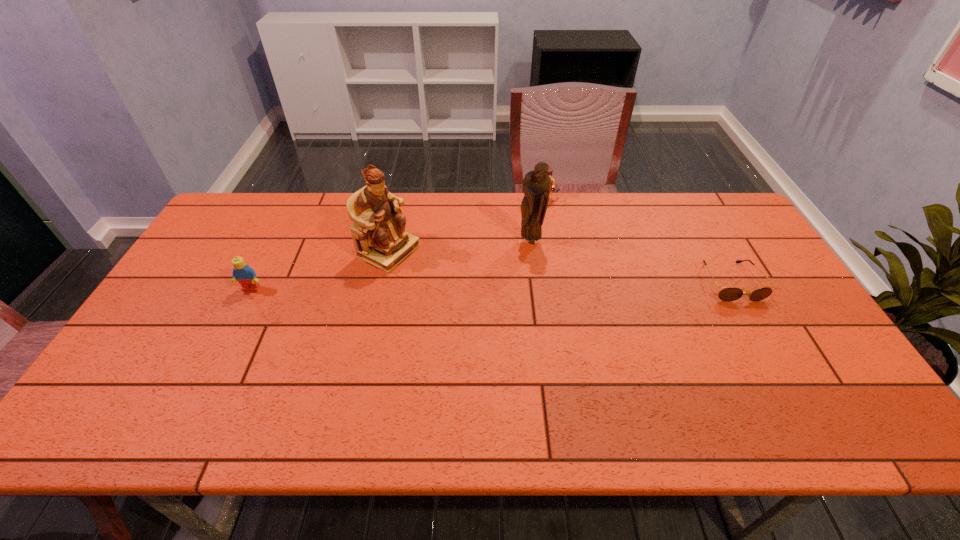
Where is `the nearer Lego`? the nearer Lego is located at coordinates pyautogui.click(x=245, y=275).

This screenshot has width=960, height=540. I want to click on the left Lego, so click(245, 275).

The image size is (960, 540). Find the location of `the rightmost object`. the rightmost object is located at coordinates (728, 294).

At what (x,y) coordinates should I click in order to perform the action: click on the shortest object. Please return your answer as a coordinate pair (x, y). The width and height of the screenshot is (960, 540). Looking at the image, I should click on (728, 294).

Identify the location of the left figurine. Image resolution: width=960 pixels, height=540 pixels. (378, 232).

Identify the location of the right figurine. (536, 186).

Where is `the right Lego`? This screenshot has height=540, width=960. the right Lego is located at coordinates (550, 171).

Where is `the farthest object`? the farthest object is located at coordinates (550, 171).

Find the location of a particular element. The height and width of the screenshot is (540, 960). free space located 0.320m on the face of the nearer Lego is located at coordinates (198, 394).

I want to click on vacant space located 0.220m on the front-facing side of the sunglasses, so click(x=780, y=370).